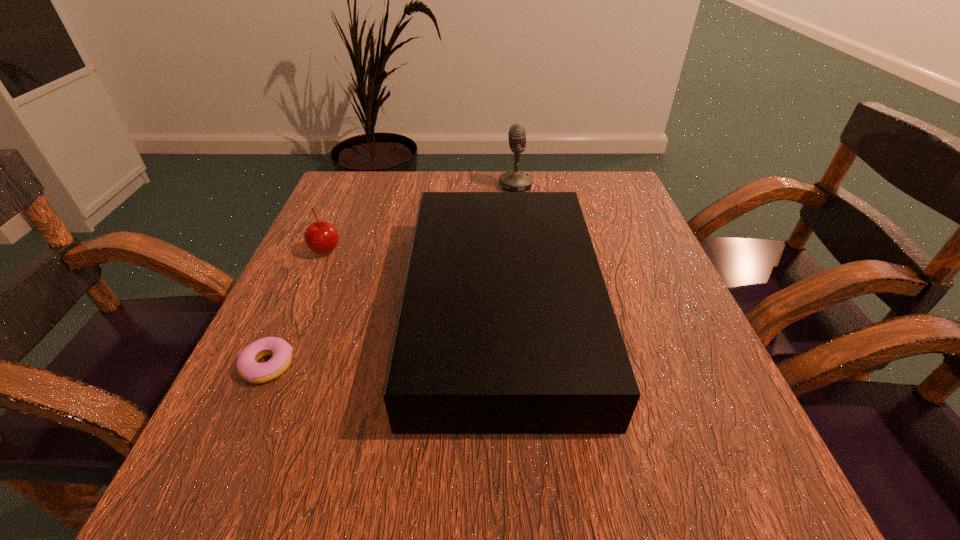
Identify the location of vacant space located 0.130m at the front of the second tallest object for disc insertion. This screenshot has height=540, width=960. (341, 310).

Identify the location of free space located on the front of the third tallest object. Image resolution: width=960 pixels, height=540 pixels. (286, 343).

At what (x,y) coordinates should I click in order to perform the action: click on free space located on the right of the shortest object. Please return your answer as a coordinate pair (x, y). The width and height of the screenshot is (960, 540). Looking at the image, I should click on (517, 366).

This screenshot has width=960, height=540. Find the location of `object located in the far edge section of the desktop`. object located in the far edge section of the desktop is located at coordinates (514, 180).

Locate an element on the screen. The width and height of the screenshot is (960, 540). cherry located in the left edge section of the desktop is located at coordinates point(322,237).

The image size is (960, 540). Find the location of `doughnut that is at the left edge`. doughnut that is at the left edge is located at coordinates (247, 364).

The width and height of the screenshot is (960, 540). In the image, there is a desktop. Find the location of `blank space at the far edge`. blank space at the far edge is located at coordinates (400, 219).

Identify the location of free space at the left edge of the desktop. (344, 304).

Find the location of `vacant point at the right edge`. vacant point at the right edge is located at coordinates (615, 301).

In the image, there is a desktop. What are the coordinates of `vacant space at the far right corner` in the screenshot? It's located at (608, 177).